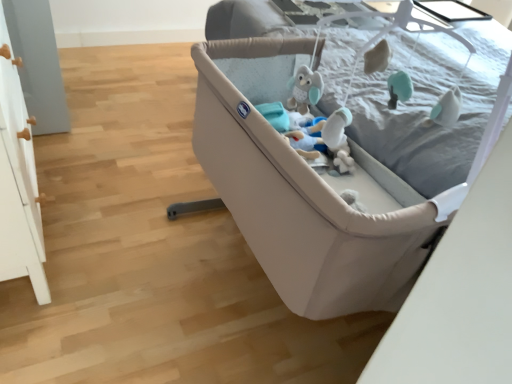
Locate an element on the screen. The width and height of the screenshot is (512, 384). free space to the left of beige fabric crib at center is located at coordinates (124, 239).